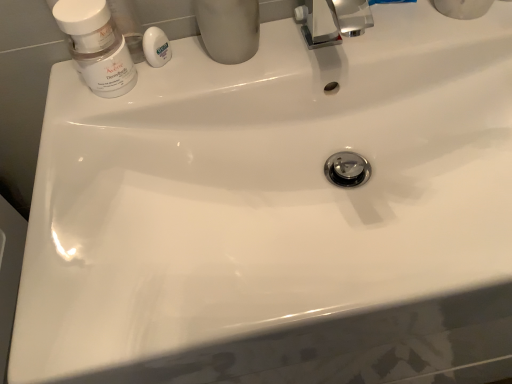
Locate an element on the screen. vacant space that is in between matte gray cup at upper center and matte white jar at upper left is located at coordinates (180, 78).